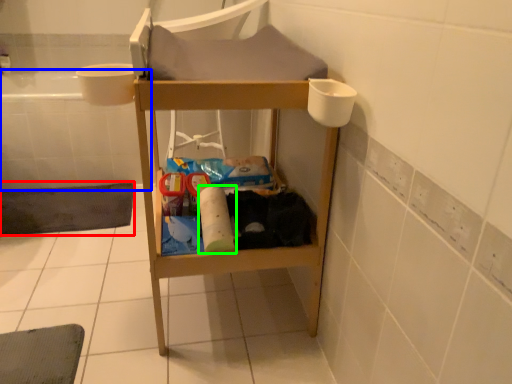
Question: Estimate the real-world distances between objects in this image. Which object is closer to bath mat (highlighted by a red box), bath (highlighted by a blue box) or toilet paper (highlighted by a green box)?

Choices:
 (A) bath
 (B) toilet paper

Answer: (A)